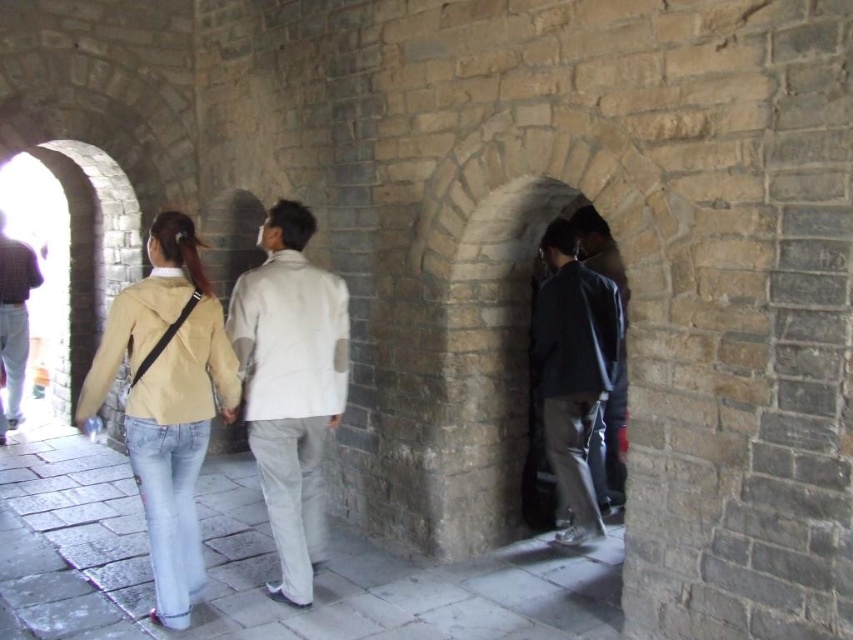
You are standing at the entrance of the stone structure and see the point marked at coordinates (289, 385). What object is located exactly at that point?

The white matte jacket at center is located exactly at point (289, 385).